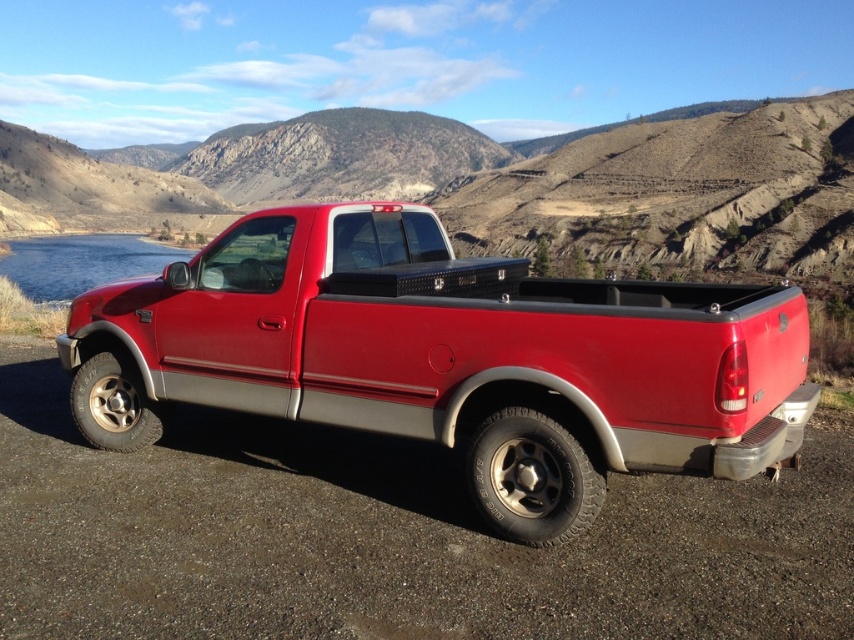
You are a delivery driver who needs to park your matte red truck at center in a specific spot marked at coordinates point 0.561, 0.528. Can you confirm if the truck is already parked correctly?

The matte red truck at center is already positioned at point (449, 358), so it is parked correctly.

You are a hiker who needs to cross the blue glassy water at left to reach the matte red truck at center. The bridge you need to use has a maximum weight capacity of 60 meters. Can you safely cross using this bridge?

The matte red truck at center is 59.55 meters away from the blue glassy water at left. Since the bridge can hold up to 60 meters, the distance is within the limit, so you can safely cross.